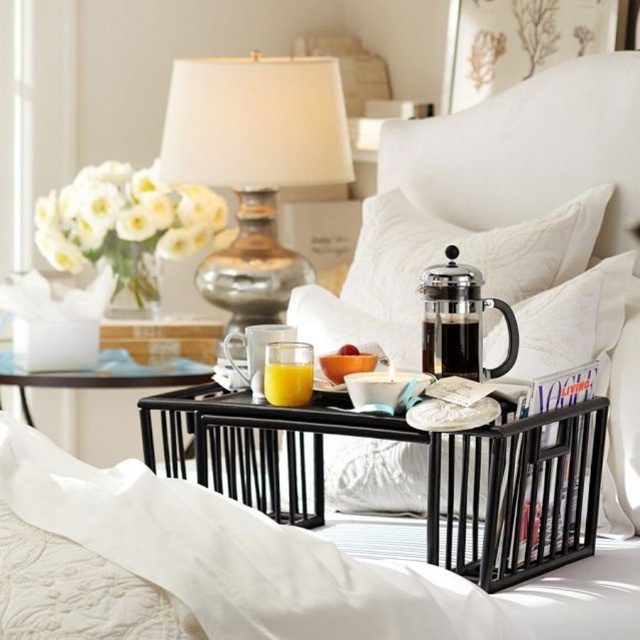
Question: Can you confirm if translucent glass at center is positioned below smooth orange bowl at center?

Choices:
 (A) no
 (B) yes

Answer: (B)

Question: Based on their relative distances, which object is farther from the orange matte/porcelain bowl at center?

Choices:
 (A) translucent glass at center
 (B) black metal tray at center

Answer: (B)

Question: Can you confirm if metallic glass lamp at upper left is smaller than smooth orange bowl at center?

Choices:
 (A) yes
 (B) no

Answer: (B)

Question: Based on their relative distances, which object is farther from the orange matte/porcelain bowl at center?

Choices:
 (A) smooth orange bowl at center
 (B) black metal tray at lower center

Answer: (B)

Question: Does satin white pillow at center appear under black metal tray at lower center?

Choices:
 (A) yes
 (B) no

Answer: (B)

Question: Which object is the closest to the orange matte/porcelain bowl at center?

Choices:
 (A) metallic glass lamp at upper left
 (B) black metal tray at lower center

Answer: (A)